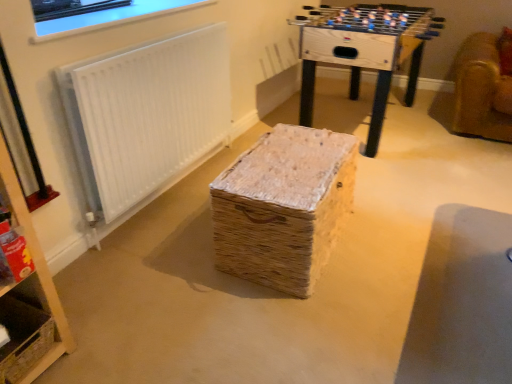
At what (x,y) coordinates should I click in order to perform the action: click on free location in front of woven straw basket at center. Please return your answer as a coordinate pair (x, y). This screenshot has width=512, height=384. Looking at the image, I should click on (306, 325).